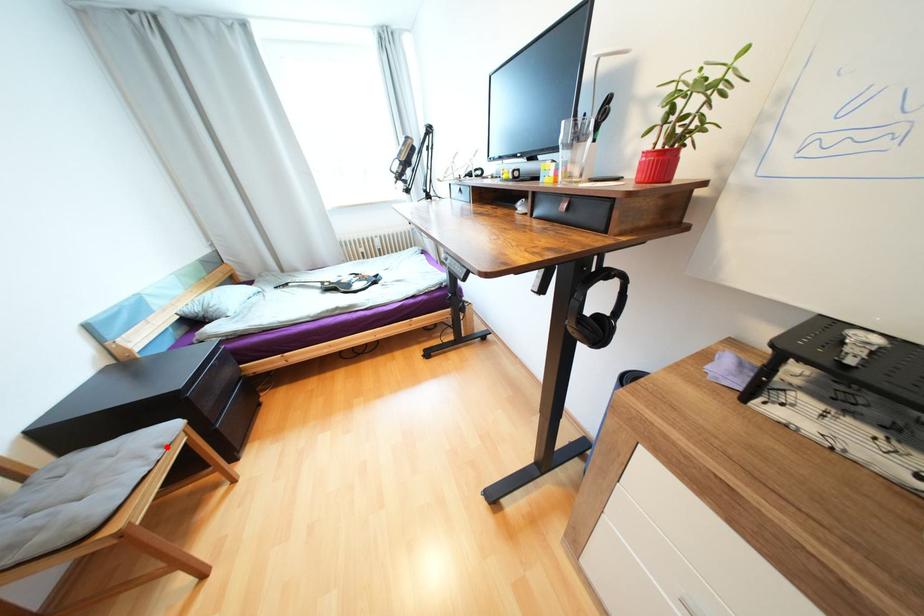
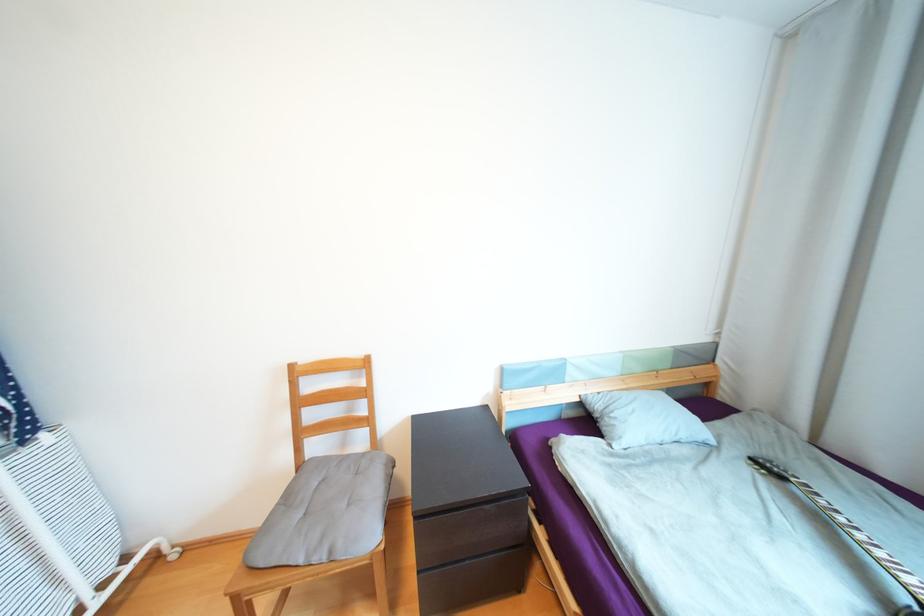
Locate, in the second image, the point that corresponds to the highlighted location in the first image.

(335, 553)